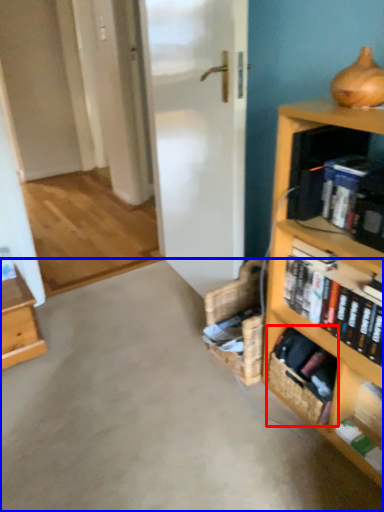
Question: Which point is closer to the camera, basket (highlighted by a red box) or concrete (highlighted by a blue box)?

Choices:
 (A) basket
 (B) concrete

Answer: (B)